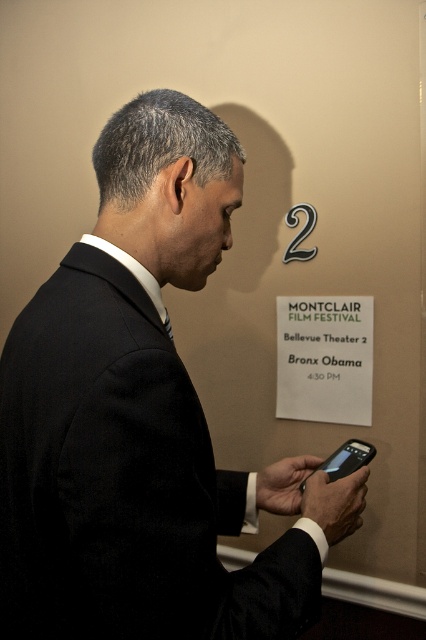
Question: Can you confirm if black matte suit at center is positioned above white paper sign at upper center?

Choices:
 (A) yes
 (B) no

Answer: (A)

Question: Which of the following is the farthest from the observer?

Choices:
 (A) (31, 308)
 (B) (313, 381)

Answer: (B)

Question: Can you confirm if black matte suit at center is positioned to the right of white paper sign at upper center?

Choices:
 (A) no
 (B) yes

Answer: (A)

Question: Can you confirm if black matte suit at center is positioned below white paper sign at upper center?

Choices:
 (A) yes
 (B) no

Answer: (B)